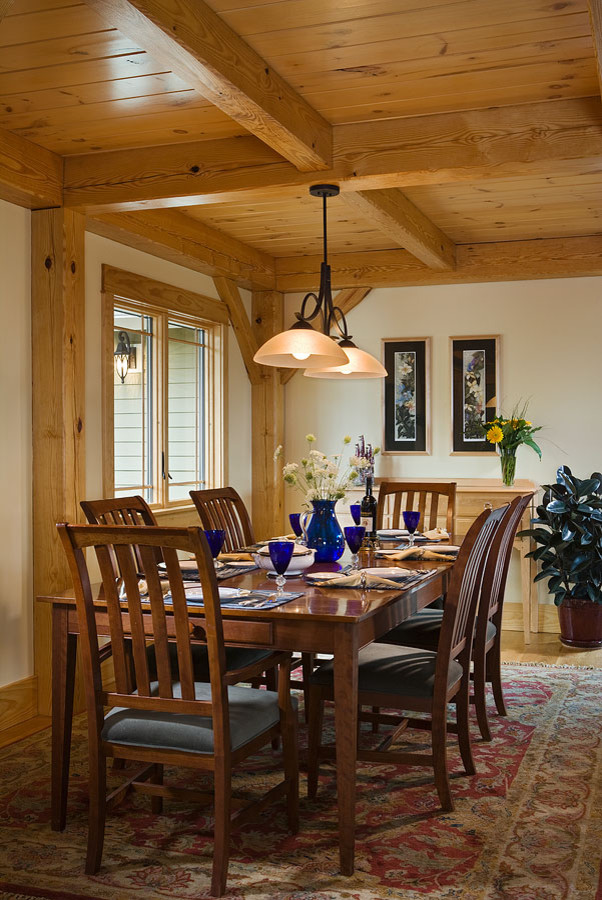
Where is `plant`? This screenshot has height=900, width=602. plant is located at coordinates (515, 436), (574, 544), (320, 464).